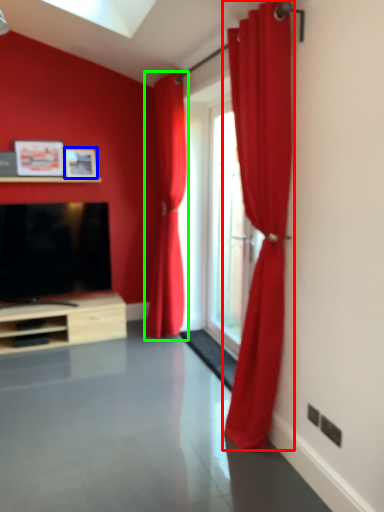
Question: Estimate the real-world distances between objects in this image. Which object is farther from curtain (highlighted by a red box), picture frame (highlighted by a blue box) or curtain (highlighted by a green box)?

Choices:
 (A) picture frame
 (B) curtain

Answer: (A)